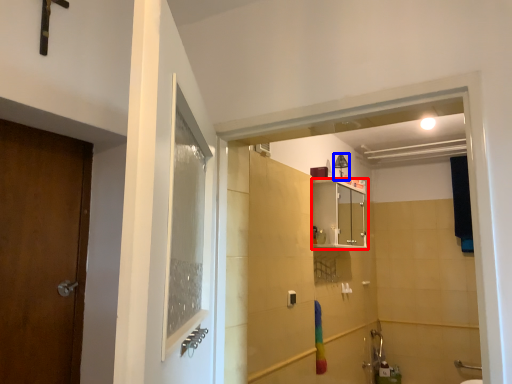
Question: Which object appears farthest to the camera in this image, cabinetry (highlighted by a red box) or light fixture (highlighted by a blue box)?

Choices:
 (A) cabinetry
 (B) light fixture

Answer: (B)